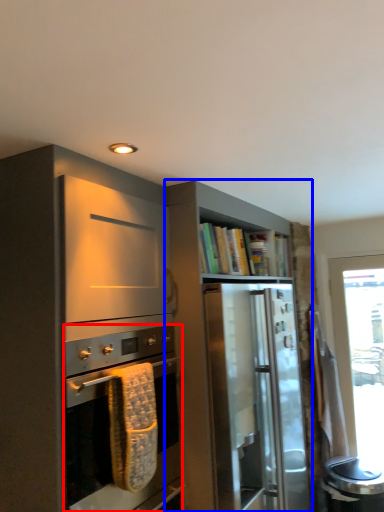
Question: Among these objects, which one is farthest to the camera, oven (highlighted by a red box) or cabinetry (highlighted by a blue box)?

Choices:
 (A) oven
 (B) cabinetry

Answer: (B)